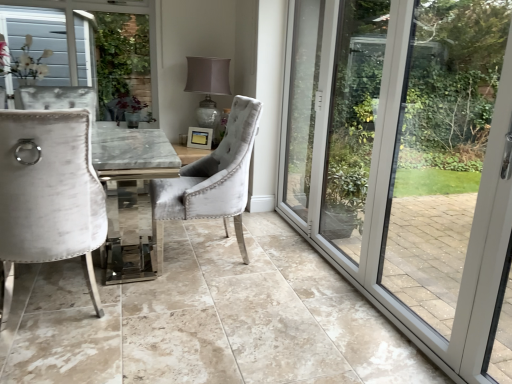
Where is `free space between velvet white chair at left, placed as the 1th chair when sorted from left to right, and velvet grey chair at center, which is counted as the first chair, starting from the right`? This screenshot has width=512, height=384. free space between velvet white chair at left, placed as the 1th chair when sorted from left to right, and velvet grey chair at center, which is counted as the first chair, starting from the right is located at coordinates (156, 287).